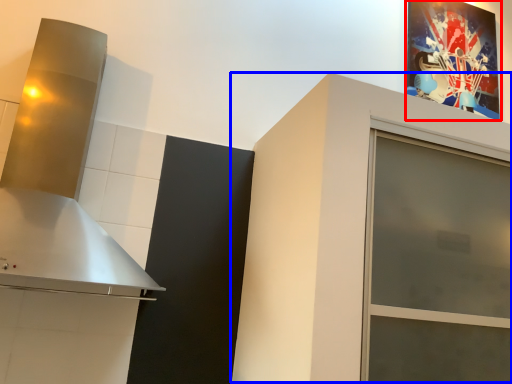
Question: Which of the following is the closest to the observer, picture frame (highlighted by a red box) or cabinetry (highlighted by a blue box)?

Choices:
 (A) picture frame
 (B) cabinetry

Answer: (B)